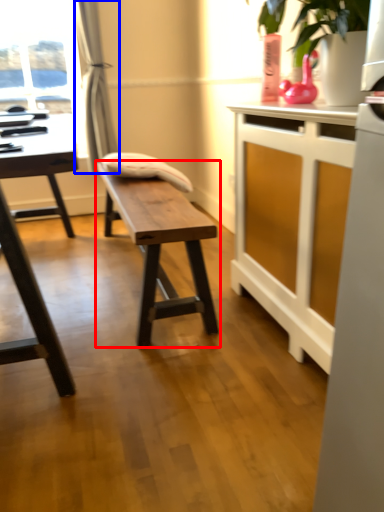
Question: Which of the following is the closest to the observer, table (highlighted by a red box) or curtain (highlighted by a blue box)?

Choices:
 (A) table
 (B) curtain

Answer: (A)